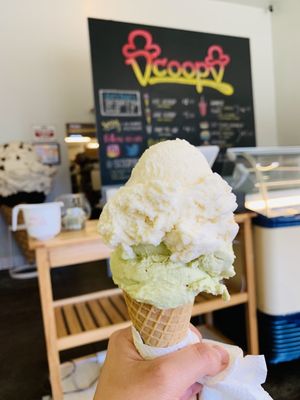
Locate an element on the screen. The height and width of the screenshot is (400, 300). cup is located at coordinates (47, 235).